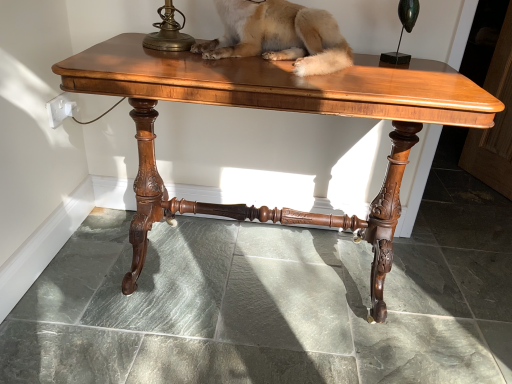
Question: Does shiny brown wood table at center touch fuzzy beige dog at center?

Choices:
 (A) yes
 (B) no

Answer: (B)

Question: Considering the relative positions of shiny brown wood table at center and fuzzy beige dog at center in the image provided, is shiny brown wood table at center to the left of fuzzy beige dog at center from the viewer's perspective?

Choices:
 (A) no
 (B) yes

Answer: (B)

Question: Can we say shiny brown wood table at center lies outside fuzzy beige dog at center?

Choices:
 (A) yes
 (B) no

Answer: (A)

Question: Are shiny brown wood table at center and fuzzy beige dog at center located far from each other?

Choices:
 (A) yes
 (B) no

Answer: (B)

Question: Does shiny brown wood table at center have a greater height compared to fuzzy beige dog at center?

Choices:
 (A) yes
 (B) no

Answer: (A)

Question: From a real-world perspective, is fuzzy beige dog at center physically located above or below green polished glass candle holder at upper right?

Choices:
 (A) above
 (B) below

Answer: (B)

Question: From the image's perspective, is fuzzy beige dog at center above or below green polished glass candle holder at upper right?

Choices:
 (A) above
 (B) below

Answer: (B)

Question: Based on their positions, is fuzzy beige dog at center located to the left or right of green polished glass candle holder at upper right?

Choices:
 (A) right
 (B) left

Answer: (B)

Question: From their relative heights in the image, would you say fuzzy beige dog at center is taller or shorter than green polished glass candle holder at upper right?

Choices:
 (A) tall
 (B) short

Answer: (B)

Question: In terms of size, does green polished glass candle holder at upper right appear bigger or smaller than fuzzy beige dog at center?

Choices:
 (A) big
 (B) small

Answer: (B)

Question: Considering the positions of green polished glass candle holder at upper right and fuzzy beige dog at center in the image, is green polished glass candle holder at upper right taller or shorter than fuzzy beige dog at center?

Choices:
 (A) short
 (B) tall

Answer: (B)

Question: Would you say green polished glass candle holder at upper right is inside or outside fuzzy beige dog at center?

Choices:
 (A) outside
 (B) inside

Answer: (A)

Question: Considering the relative positions of green polished glass candle holder at upper right and fuzzy beige dog at center in the image provided, is green polished glass candle holder at upper right to the left or to the right of fuzzy beige dog at center?

Choices:
 (A) right
 (B) left

Answer: (A)

Question: Based on their sizes in the image, would you say shiny brown wood table at center is bigger or smaller than fuzzy beige dog at center?

Choices:
 (A) big
 (B) small

Answer: (A)

Question: Would you say shiny brown wood table at center is to the left or to the right of fuzzy beige dog at center in the picture?

Choices:
 (A) right
 (B) left

Answer: (B)